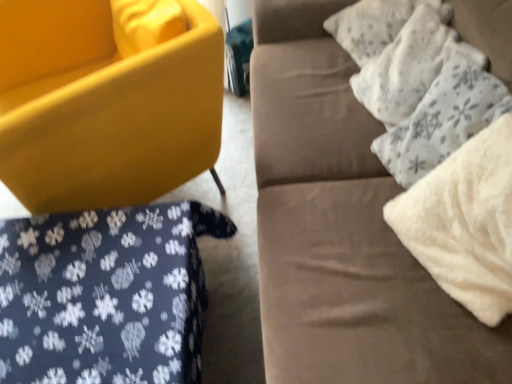
Measure the distance between white textured pillow at upper right, the second pillow when ordered from bottom to top, and camera.

white textured pillow at upper right, the second pillow when ordered from bottom to top, and camera are 1.09 meters apart.

What do you see at coordinates (443, 119) in the screenshot?
I see `white fluffy pillow at upper right, acting as the 1th pillow starting from the bottom` at bounding box center [443, 119].

Identify the location of white fluffy pillow at right. (465, 222).

Describe the element at coordinates (104, 106) in the screenshot. I see `matte yellow chair at lower left` at that location.

Where is `white textured pillow at upper right, marked as the first pillow in a top-to-bottom arrangement`? This screenshot has width=512, height=384. white textured pillow at upper right, marked as the first pillow in a top-to-bottom arrangement is located at coordinates (409, 66).

Looking at this image, is white textured pillow at upper right, marked as the first pillow in a top-to-bottom arrangement, spatially inside white fluffy pillow at right, or outside of it?

white textured pillow at upper right, marked as the first pillow in a top-to-bottom arrangement, is located beyond the bounds of white fluffy pillow at right.

Can you see white textured pillow at upper right, the second pillow when ordered from bottom to top, touching white fluffy pillow at right?

No, white textured pillow at upper right, the second pillow when ordered from bottom to top, is not touching white fluffy pillow at right.

From a real-world perspective, who is located higher, white textured pillow at upper right, marked as the first pillow in a top-to-bottom arrangement, or white fluffy pillow at right?

white fluffy pillow at right is physically above.

Is white textured pillow at upper right, the second pillow when ordered from bottom to top, facing away from white fluffy pillow at right?

No, white fluffy pillow at right is not at the back of white textured pillow at upper right, the second pillow when ordered from bottom to top.

Between white fluffy pillow at upper right, acting as the 1th pillow starting from the bottom, and white fluffy pillow at right, which one appears on the right side from the viewer's perspective?

Positioned to the right is white fluffy pillow at right.

From the image's perspective, is white fluffy pillow at upper right, which is the 2th pillow from top to bottom, over white fluffy pillow at right?

Yes, from the image's perspective, white fluffy pillow at upper right, which is the 2th pillow from top to bottom, is above white fluffy pillow at right.

Are white fluffy pillow at upper right, which is the 2th pillow from top to bottom, and white fluffy pillow at right making contact?

white fluffy pillow at upper right, which is the 2th pillow from top to bottom, is not next to white fluffy pillow at right, and they're not touching.

How different are the orientations of white fluffy pillow at upper right, which is the 2th pillow from top to bottom, and white fluffy pillow at right in degrees?

2.1 degrees separate the facing orientations of white fluffy pillow at upper right, which is the 2th pillow from top to bottom, and white fluffy pillow at right.

Locate an element on the screen. bedding in front of the matte yellow chair at lower left is located at coordinates (105, 295).

Is matte yellow chair at lower left facing towards dark blue fabric with white snowflake pattern at lower left?

No, matte yellow chair at lower left is not aimed at dark blue fabric with white snowflake pattern at lower left.

From the image's perspective, is matte yellow chair at lower left on top of dark blue fabric with white snowflake pattern at lower left?

Yes, from the image's perspective, matte yellow chair at lower left is above dark blue fabric with white snowflake pattern at lower left.

Which is more to the left, matte yellow chair at lower left or dark blue fabric with white snowflake pattern at lower left?

matte yellow chair at lower left is more to the left.

Is white textured pillow at upper right, the second pillow when ordered from bottom to top, to the left or to the right of dark blue fabric with white snowflake pattern at lower left in the image?

white textured pillow at upper right, the second pillow when ordered from bottom to top, is positioned on dark blue fabric with white snowflake pattern at lower left's right side.

Does white textured pillow at upper right, marked as the first pillow in a top-to-bottom arrangement, lie in front of dark blue fabric with white snowflake pattern at lower left?

No, white textured pillow at upper right, marked as the first pillow in a top-to-bottom arrangement, is further to the viewer.

How different are the orientations of white textured pillow at upper right, marked as the first pillow in a top-to-bottom arrangement, and dark blue fabric with white snowflake pattern at lower left in degrees?

20.8 degrees.

From the picture: In the image, is white fluffy pillow at right on the left side or the right side of dark blue fabric with white snowflake pattern at lower left?

Clearly, white fluffy pillow at right is on the right of dark blue fabric with white snowflake pattern at lower left in the image.

Is white fluffy pillow at right beside dark blue fabric with white snowflake pattern at lower left?

No, white fluffy pillow at right is not touching dark blue fabric with white snowflake pattern at lower left.

Which is behind, white fluffy pillow at right or dark blue fabric with white snowflake pattern at lower left?

dark blue fabric with white snowflake pattern at lower left is further away from the camera.

Considering the points (431, 247) and (100, 365), which point is behind, point (431, 247) or point (100, 365)?

The point (431, 247) is behind.

How different are the orientations of white fluffy pillow at right and white fluffy pillow at upper right, which is the 2th pillow from top to bottom, in degrees?

The angle between the facing direction of white fluffy pillow at right and the facing direction of white fluffy pillow at upper right, which is the 2th pillow from top to bottom, is 2.1 degrees.

Is white fluffy pillow at right facing towards white fluffy pillow at upper right, which is the 2th pillow from top to bottom?

No, white fluffy pillow at right is not aimed at white fluffy pillow at upper right, which is the 2th pillow from top to bottom.

Is white fluffy pillow at right directly adjacent to white fluffy pillow at upper right, acting as the 1th pillow starting from the bottom?

white fluffy pillow at right and white fluffy pillow at upper right, acting as the 1th pillow starting from the bottom, are clearly separated.

Is white fluffy pillow at right in contact with matte yellow chair at lower left?

white fluffy pillow at right is not next to matte yellow chair at lower left, and they're not touching.

Is white fluffy pillow at right positioned with its back to matte yellow chair at lower left?

No.

Is white fluffy pillow at right to the left of matte yellow chair at lower left from the viewer's perspective?

No.

Which of these two, white fluffy pillow at right or matte yellow chair at lower left, is smaller?

Smaller between the two is white fluffy pillow at right.

What are the coordinates of `material that appears in front of the white textured pillow at upper right, marked as the first pillow in a top-to-bottom arrangement` in the screenshot? It's located at (465, 222).

The width and height of the screenshot is (512, 384). Find the location of `material below the white fluffy pillow at upper right, acting as the 1th pillow starting from the bottom (from a real-world perspective)`. material below the white fluffy pillow at upper right, acting as the 1th pillow starting from the bottom (from a real-world perspective) is located at coordinates (465, 222).

Based on their spatial positions, is white fluffy pillow at upper right, which is the 2th pillow from top to bottom, or matte yellow chair at lower left closer to white fluffy pillow at right?

Among the two, white fluffy pillow at upper right, which is the 2th pillow from top to bottom, is located nearer to white fluffy pillow at right.

Looking at the image, which one is located closer to white fluffy pillow at right, suede couch at upper right or white fluffy pillow at upper right, which is the 2th pillow from top to bottom?

Based on the image, white fluffy pillow at upper right, which is the 2th pillow from top to bottom, appears to be nearer to white fluffy pillow at right.

Based on their spatial positions, is white fluffy pillow at right or dark blue fabric with white snowflake pattern at lower left further from matte yellow chair at lower left?

Among the two, white fluffy pillow at right is located further to matte yellow chair at lower left.

Looking at the image, which one is located further to dark blue fabric with white snowflake pattern at lower left, suede couch at upper right or white fluffy pillow at right?

Among the two, white fluffy pillow at right is located further to dark blue fabric with white snowflake pattern at lower left.

When comparing their distances from dark blue fabric with white snowflake pattern at lower left, does white fluffy pillow at right or white textured pillow at upper right, marked as the first pillow in a top-to-bottom arrangement, seem closer?

The object closer to dark blue fabric with white snowflake pattern at lower left is white fluffy pillow at right.

From the image, which object appears to be farther from dark blue fabric with white snowflake pattern at lower left, matte yellow chair at lower left or white textured pillow at upper right, the second pillow when ordered from bottom to top?

white textured pillow at upper right, the second pillow when ordered from bottom to top, lies further to dark blue fabric with white snowflake pattern at lower left than the other object.

Considering their positions, is suede couch at upper right positioned closer to white textured pillow at upper right, the second pillow when ordered from bottom to top, than white fluffy pillow at upper right, acting as the 1th pillow starting from the bottom?

white fluffy pillow at upper right, acting as the 1th pillow starting from the bottom, lies closer to white textured pillow at upper right, the second pillow when ordered from bottom to top, than the other object.

When comparing their distances from matte yellow chair at lower left, does white fluffy pillow at right or suede couch at upper right seem further?

white fluffy pillow at right is further to matte yellow chair at lower left.

Identify the location of studio couch between dark blue fabric with white snowflake pattern at lower left and white fluffy pillow at right. The width and height of the screenshot is (512, 384). (342, 229).

Locate an element on the screen. material located between suede couch at upper right and white textured pillow at upper right, marked as the first pillow in a top-to-bottom arrangement, in the depth direction is located at coordinates [465, 222].

You are a GUI agent. You are given a task and a screenshot of the screen. Output one action in this format:
    pyautogui.click(x=<x>, y=<y>)
    Task: Click on the studio couch located between matte yellow chair at lower left and white textured pillow at upper right, marked as the first pillow in a top-to-bottom arrangement, in the left-right direction
    The height and width of the screenshot is (384, 512).
    Given the screenshot: What is the action you would take?
    pyautogui.click(x=342, y=229)

Find the location of a particular element. This screenshot has height=384, width=512. bedding between matte yellow chair at lower left and white textured pillow at upper right, the second pillow when ordered from bottom to top, in the horizontal direction is located at coordinates (105, 295).